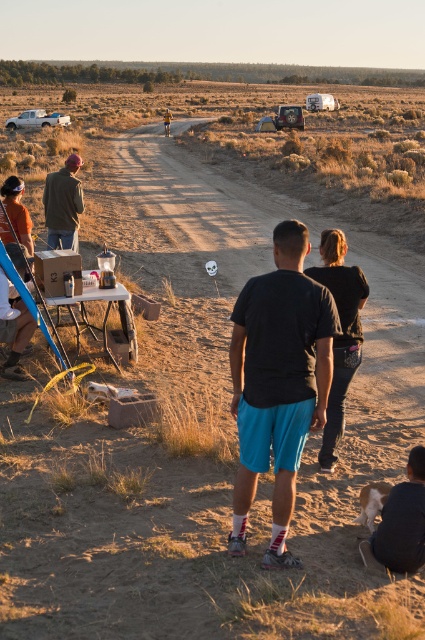
You are organizing a small gathering in the desert and need to decide where to place a large cooler. You see the matte green jacket at left and the wooden picnic table at lower left. Which object should you place the cooler next to if you want it to be proportionally sized to the existing items?

The matte green jacket at left has a larger size compared to the wooden picnic table at lower left. Therefore, placing the cooler next to the matte green jacket at left would ensure it is proportionally sized to the existing items.

You are standing at the point marked as point (249, 332) in the image. You want to walk straight towards the nearest tree in the background. How far will you have to walk before reaching the tree?

The distance of point (249, 332) from viewer is 4.08 meters. Since the trees are in the background, they are farther away than the point. Therefore, you would need to walk more than 4.08 meters to reach the nearest tree.